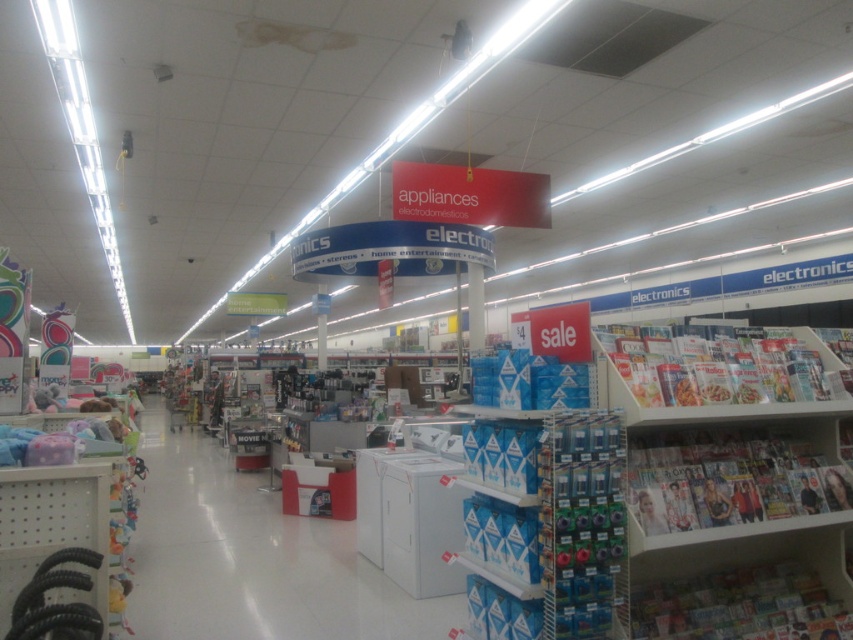
You need to place a tall promotional stand that requires 1.2 meters of height. Looking at the white glossy magazine rack at lower right and the white plastic magazine rack at right, which one is more suitable for placing the stand?

The white plastic magazine rack at right is taller than the white glossy magazine rack at lower right, so it is more suitable for placing the tall promotional stand that requires 1.2 meters of height.

You are a store employee who needs to place a new white glossy appliance at center on the shelf next to the white plastic magazine rack at right. The shelf can only hold items up to the width of the magazine rack. Can the appliance fit on the shelf?

The white glossy appliance at center is wider than the white plastic magazine rack at right, so it cannot fit on the shelf designed for items up to the magazine rack width.